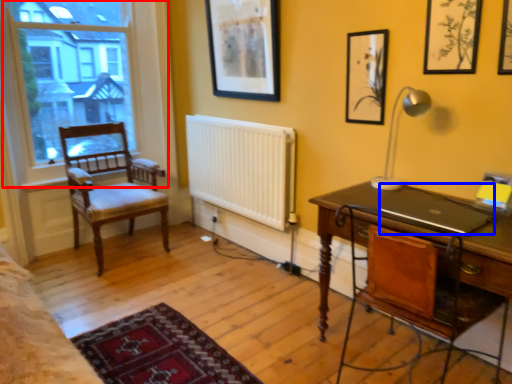
Question: Which object is further to the camera taking this photo, window (highlighted by a red box) or laptop (highlighted by a blue box)?

Choices:
 (A) window
 (B) laptop

Answer: (A)